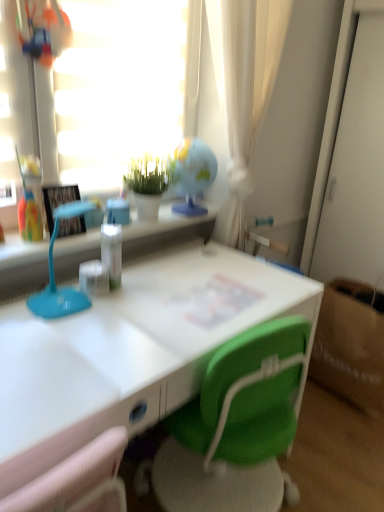
Question: From the image's perspective, is transparent glass globe at upper center on top of brown paper bag at lower right?

Choices:
 (A) yes
 (B) no

Answer: (A)

Question: Is transparent glass globe at upper center smaller than brown paper bag at lower right?

Choices:
 (A) no
 (B) yes

Answer: (B)

Question: Would you say transparent glass globe at upper center is a long distance from brown paper bag at lower right?

Choices:
 (A) no
 (B) yes

Answer: (B)

Question: Is transparent glass globe at upper center in front of brown paper bag at lower right?

Choices:
 (A) yes
 (B) no

Answer: (A)

Question: Is transparent glass globe at upper center directly adjacent to brown paper bag at lower right?

Choices:
 (A) no
 (B) yes

Answer: (A)

Question: Considering the relative sizes of transparent glass globe at upper center and brown paper bag at lower right in the image provided, is transparent glass globe at upper center thinner than brown paper bag at lower right?

Choices:
 (A) no
 (B) yes

Answer: (B)

Question: Is matte black picture frame at left smaller than brown paper bag at lower right?

Choices:
 (A) yes
 (B) no

Answer: (A)

Question: Considering the relative positions of matte black picture frame at left and brown paper bag at lower right in the image provided, is matte black picture frame at left to the right of brown paper bag at lower right from the viewer's perspective?

Choices:
 (A) yes
 (B) no

Answer: (B)

Question: Does matte black picture frame at left have a lesser height compared to brown paper bag at lower right?

Choices:
 (A) no
 (B) yes

Answer: (B)

Question: Could brown paper bag at lower right be considered to be inside matte black picture frame at left?

Choices:
 (A) no
 (B) yes

Answer: (A)

Question: Does matte black picture frame at left have a greater height compared to brown paper bag at lower right?

Choices:
 (A) no
 (B) yes

Answer: (A)

Question: From the image's perspective, does matte black picture frame at left appear lower than brown paper bag at lower right?

Choices:
 (A) no
 (B) yes

Answer: (A)

Question: Can you confirm if green matte plant at upper center is wider than transparent glass globe at upper center?

Choices:
 (A) yes
 (B) no

Answer: (A)